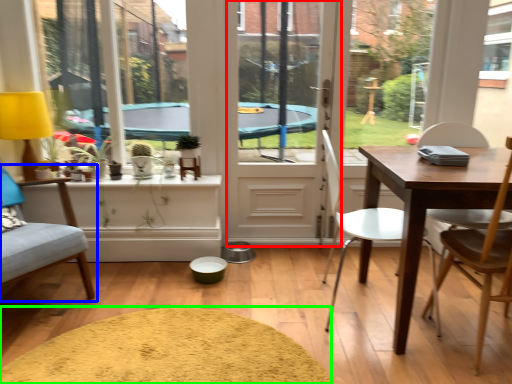
Question: Which is farther away from screen door (highlighted by a red box)? chair (highlighted by a blue box) or wide (highlighted by a green box)?

Choices:
 (A) chair
 (B) wide

Answer: (A)